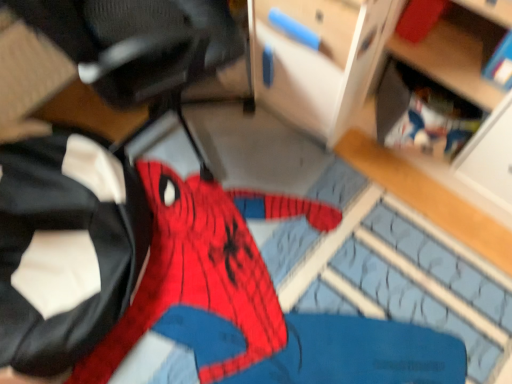
Question: From a real-world perspective, is red fabric spider-man costume at left physically below wooden shelf at lower right, which is the second shelf from back to front?

Choices:
 (A) no
 (B) yes

Answer: (B)

Question: Does red fabric spider-man costume at left have a larger size compared to wooden shelf at lower right, which ranks as the 1th shelf in front-to-back order?

Choices:
 (A) yes
 (B) no

Answer: (B)

Question: Does red fabric spider-man costume at left have a lesser height compared to wooden shelf at lower right, which is the second shelf from back to front?

Choices:
 (A) no
 (B) yes

Answer: (B)

Question: Is red fabric spider-man costume at left facing towards wooden shelf at lower right, which is the second shelf from back to front?

Choices:
 (A) no
 (B) yes

Answer: (A)

Question: Considering the relative positions of red fabric spider-man costume at left and wooden shelf at lower right, which ranks as the 1th shelf in front-to-back order, in the image provided, is red fabric spider-man costume at left to the right of wooden shelf at lower right, which ranks as the 1th shelf in front-to-back order, from the viewer's perspective?

Choices:
 (A) no
 (B) yes

Answer: (A)

Question: Can you confirm if red fabric spider-man costume at left is positioned to the left of wooden shelf at lower right, which ranks as the 1th shelf in front-to-back order?

Choices:
 (A) yes
 (B) no

Answer: (A)

Question: Is wooden shelf at lower right, which is the second shelf from back to front, located outside wooden bookshelf at upper right, arranged as the first shelf when viewed from the back?

Choices:
 (A) no
 (B) yes

Answer: (B)

Question: Is wooden shelf at lower right, which is the second shelf from back to front, closer to the viewer compared to wooden bookshelf at upper right, arranged as the first shelf when viewed from the back?

Choices:
 (A) no
 (B) yes

Answer: (B)

Question: Is wooden shelf at lower right, which ranks as the 1th shelf in front-to-back order, behind wooden bookshelf at upper right, arranged as the first shelf when viewed from the back?

Choices:
 (A) yes
 (B) no

Answer: (B)

Question: Does wooden shelf at lower right, which is the second shelf from back to front, have a lesser height compared to wooden bookshelf at upper right, which is counted as the second shelf, starting from the front?

Choices:
 (A) no
 (B) yes

Answer: (A)

Question: Considering the relative sizes of wooden shelf at lower right, which is the second shelf from back to front, and wooden bookshelf at upper right, arranged as the first shelf when viewed from the back, in the image provided, is wooden shelf at lower right, which is the second shelf from back to front, smaller than wooden bookshelf at upper right, arranged as the first shelf when viewed from the back,?

Choices:
 (A) no
 (B) yes

Answer: (A)

Question: Is wooden shelf at lower right, which ranks as the 1th shelf in front-to-back order, oriented towards wooden bookshelf at upper right, which is counted as the second shelf, starting from the front?

Choices:
 (A) yes
 (B) no

Answer: (A)

Question: From a real-world perspective, is red fabric spider-man costume at left physically above wooden bookshelf at upper right, arranged as the first shelf when viewed from the back?

Choices:
 (A) yes
 (B) no

Answer: (B)